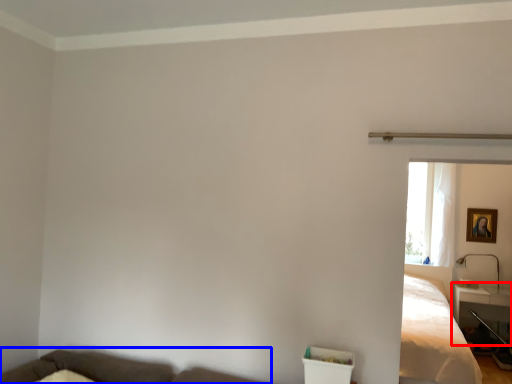
Question: Which of the following is the farthest to the observer, table (highlighted by a red box) or couch (highlighted by a blue box)?

Choices:
 (A) table
 (B) couch

Answer: (A)